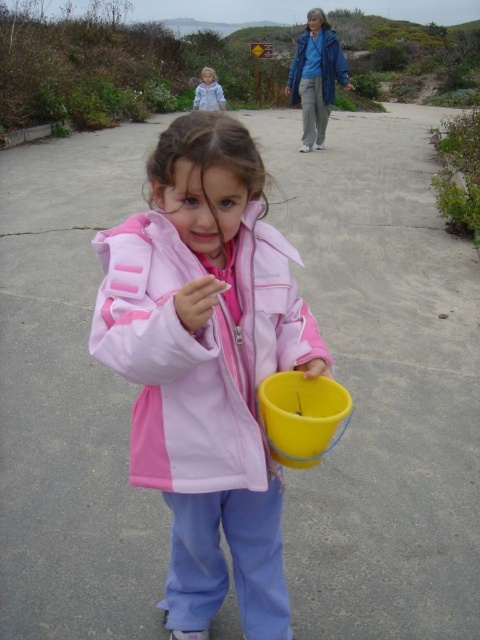
Is blue smooth jacket at upper center wider than light blue denim jacket at upper center?

Yes, blue smooth jacket at upper center is wider than light blue denim jacket at upper center.

Does point (292, 99) lie in front of point (213, 102)?

Yes.

The height and width of the screenshot is (640, 480). I want to click on blue smooth jacket at upper center, so click(x=332, y=65).

Can you confirm if pink matte jacket at center is thinner than light blue denim jacket at upper center?

Indeed, pink matte jacket at center has a lesser width compared to light blue denim jacket at upper center.

Can you confirm if pink matte jacket at center is positioned below light blue denim jacket at upper center?

Indeed, pink matte jacket at center is positioned under light blue denim jacket at upper center.

I want to click on pink matte jacket at center, so click(199, 349).

Can you confirm if pink matte jacket at center is taller than blue smooth jacket at upper center?

No.

Does point (243, 352) lie in front of point (324, 29)?

Yes, point (243, 352) is in front of point (324, 29).

I want to click on pink matte jacket at center, so click(x=199, y=349).